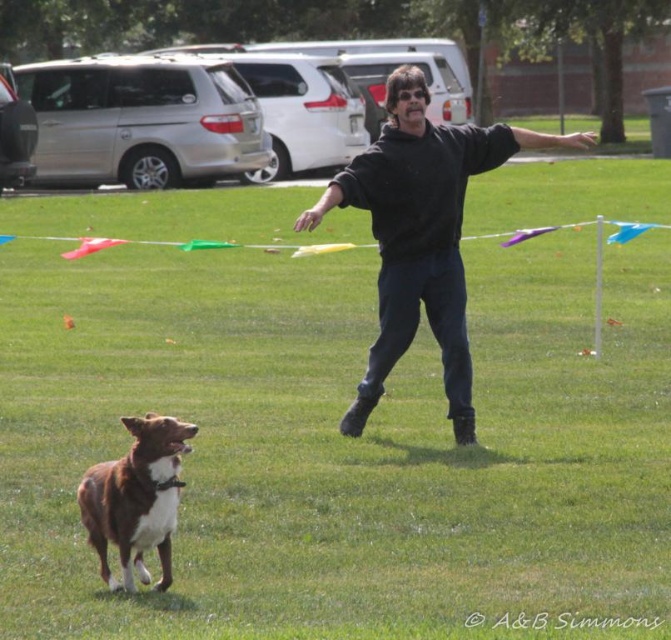
Does black sweatshirt at center have a lesser width compared to multicolored fabric kite at center?

Yes, black sweatshirt at center is thinner than multicolored fabric kite at center.

Describe the element at coordinates (419, 234) in the screenshot. This screenshot has width=671, height=640. I see `black sweatshirt at center` at that location.

Locate an element on the screen. This screenshot has height=640, width=671. black sweatshirt at center is located at coordinates (419, 234).

Between brown furry dog at lower left and multicolored fabric kite at center, which one is positioned higher?

Positioned higher is multicolored fabric kite at center.

Measure the distance between point (168, 557) and camera.

Point (168, 557) is 21.18 feet away from camera.

You are a GUI agent. You are given a task and a screenshot of the screen. Output one action in this format:
    pyautogui.click(x=<x>, y=<y>)
    Task: Click on the brown furry dog at lower left
    
    Given the screenshot: What is the action you would take?
    pyautogui.click(x=136, y=499)

Who is lower down, black sweatshirt at center or brown furry dog at lower left?

Positioned lower is brown furry dog at lower left.

Is the position of black sweatshirt at center more distant than that of brown furry dog at lower left?

Yes.

This screenshot has width=671, height=640. What are the coordinates of `black sweatshirt at center` in the screenshot? It's located at (419, 234).